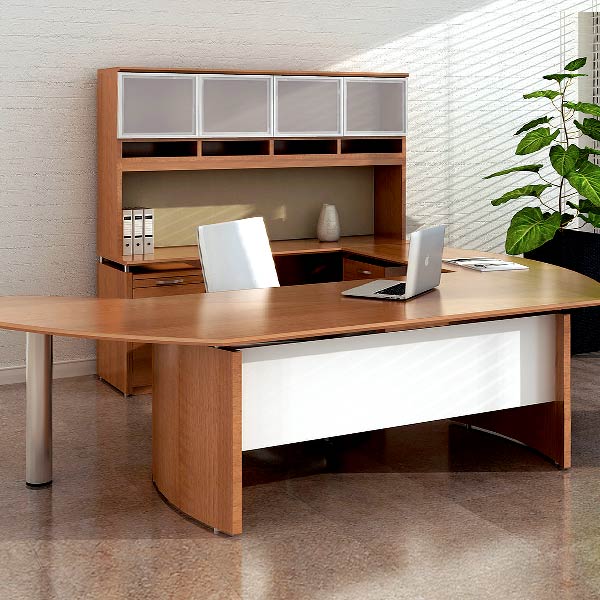
Point to all occurrences of where you'd open the cabinet in the image. Your answer should be formatted as a list of tuples, i.e. [(x1, y1), (x2, y2), ...], where each tuple contains the x and y coordinates of a point satisfying the conditions above.

[(164, 283)]